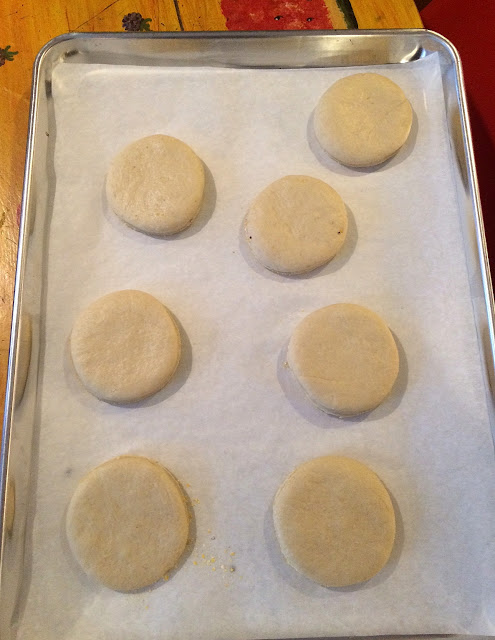
Image resolution: width=495 pixels, height=640 pixels. I want to click on table, so click(x=117, y=20).